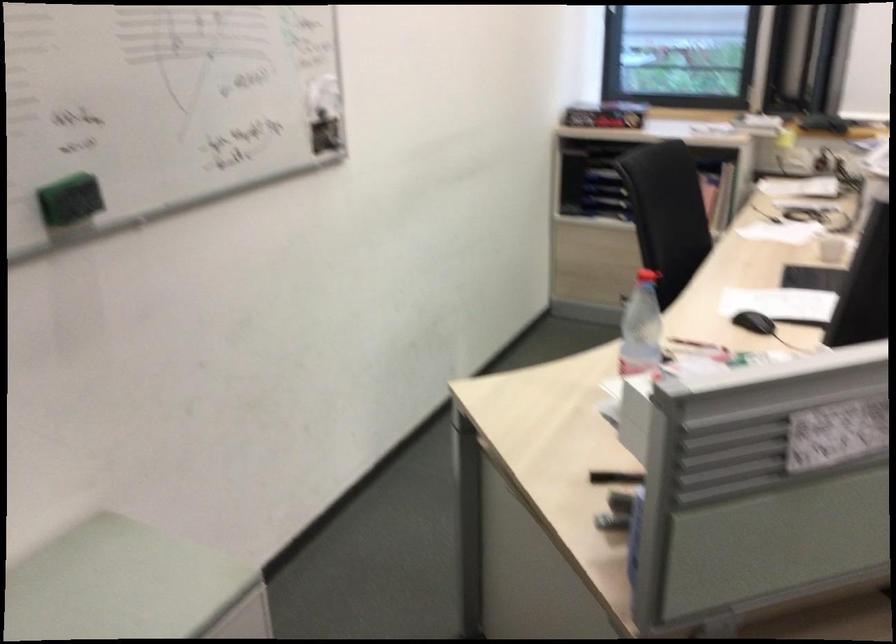
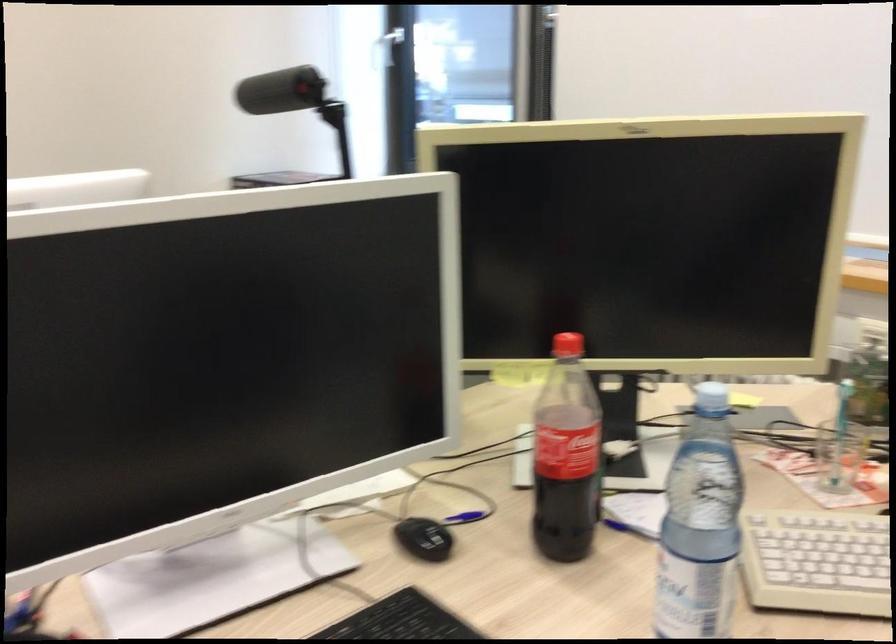
Looking at this image, the images are taken continuously from a first-person perspective. In which direction are you moving?

The cameraman moved toward right, forward.